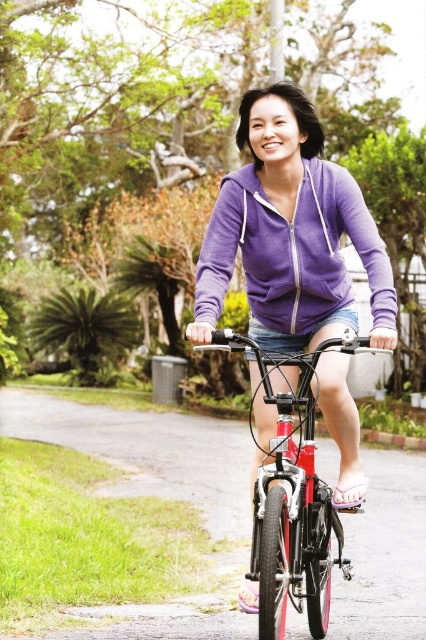
Question: Is purple fleece sweatshirt at center to the right of shiny metallic bicycle at center from the viewer's perspective?

Choices:
 (A) yes
 (B) no

Answer: (A)

Question: Is purple fleece sweatshirt at center above shiny metallic bicycle at center?

Choices:
 (A) yes
 (B) no

Answer: (A)

Question: Can you confirm if purple fleece sweatshirt at center is positioned to the right of shiny metallic bicycle at center?

Choices:
 (A) yes
 (B) no

Answer: (A)

Question: Which point is farther to the camera?

Choices:
 (A) purple fleece sweatshirt at center
 (B) shiny metallic bicycle at center

Answer: (A)